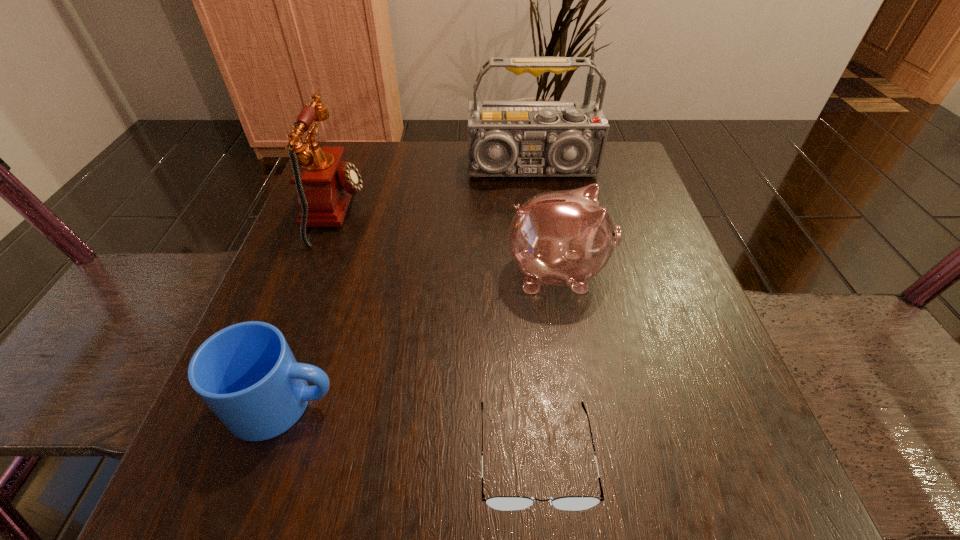
This screenshot has width=960, height=540. Find the location of `object that ranks as the fourth closest to the telephone`. object that ranks as the fourth closest to the telephone is located at coordinates (504, 503).

Identify which object is located as the nearest to the radio receiver. Please provide its 2D coordinates. Your answer should be formatted as a tuple, i.e. [(x, y)], where the tuple contains the x and y coordinates of a point satisfying the conditions above.

[(563, 238)]

What are the coordinates of `vacant area that satisfies the following two spatial constraints: 1. on the front facing side of the third tallest object; 2. on the dial of the fourth shortest object` in the screenshot? It's located at tap(547, 212).

Locate an element on the screen. The width and height of the screenshot is (960, 540). vacant space that satisfies the following two spatial constraints: 1. on the front-facing side of the tallest object; 2. on the dial of the telephone is located at coordinates (539, 212).

Identify the location of vacant space that satisfies the following two spatial constraints: 1. on the dial of the telephone; 2. on the front facing side of the third shortest object. This screenshot has width=960, height=540. (313, 272).

Image resolution: width=960 pixels, height=540 pixels. What are the coordinates of `free space that satisfies the following two spatial constraints: 1. on the dial of the fourth shortest object; 2. on the front facing side of the third tallest object` in the screenshot? It's located at (313, 272).